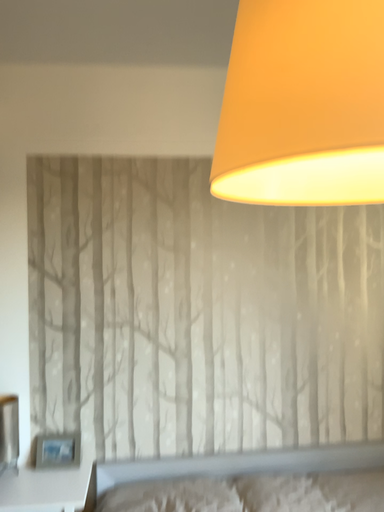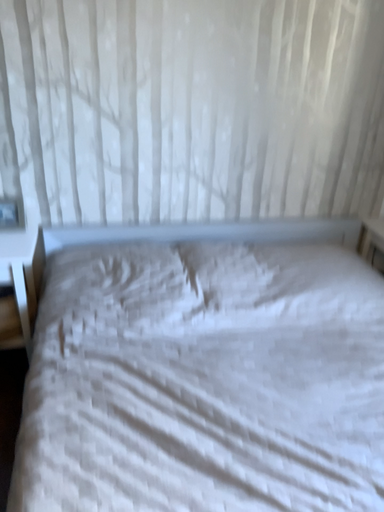
Question: How did the camera likely rotate when shooting the video?

Choices:
 (A) rotated upward
 (B) rotated downward

Answer: (B)